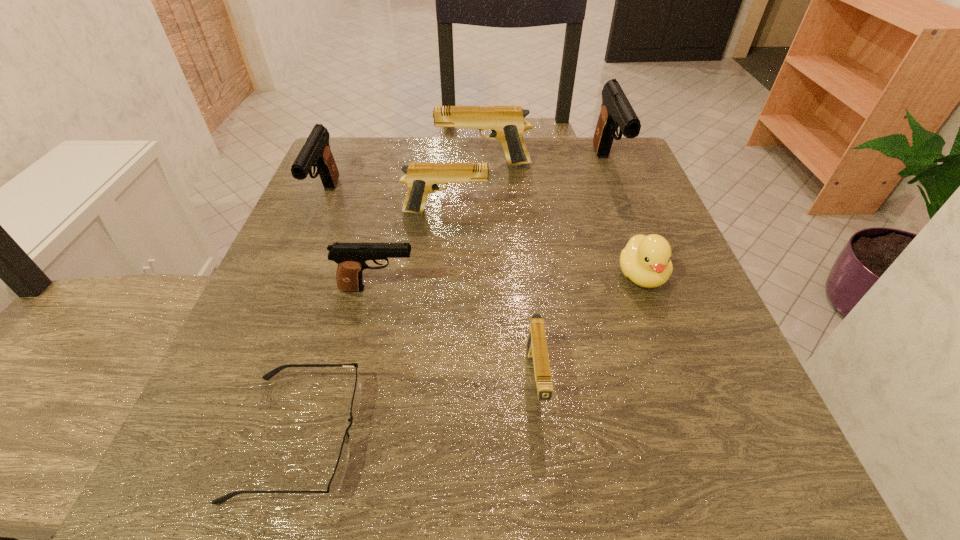
Select which pistol appears as the third closest to the farthest tan pistol. Please provide its 2D coordinates. Your answer should be formatted as a tuple, i.e. [(x, y)], where the tuple contains the x and y coordinates of a point satisfying the conditions above.

[(316, 152)]

Choose which black pistol is the nearest neighbor to the second nearest tan pistol. Please provide its 2D coordinates. Your answer should be formatted as a tuple, i.e. [(x, y)], where the tuple contains the x and y coordinates of a point satisfying the conditions above.

[(316, 152)]

Where is `black pistol that is the third nearest to the shortest object`? This screenshot has height=540, width=960. black pistol that is the third nearest to the shortest object is located at coordinates (616, 112).

Identify which tan pistol is the nearest to the second farthest tan pistol. Please provide its 2D coordinates. Your answer should be formatted as a tuple, i.e. [(x, y)], where the tuple contains the x and y coordinates of a point satisfying the conditions above.

[(507, 123)]

The image size is (960, 540). I want to click on tan pistol that stands as the third closest to the yellow duckling, so click(507, 123).

The height and width of the screenshot is (540, 960). In order to click on free spot that satisfies the following two spatial constraints: 1. on the beak of the yellow duckling; 2. on the front-facing side of the spectacles in this screenshot , I will do `click(701, 436)`.

Identify the location of free space that satisfies the following two spatial constraints: 1. on the beak of the yellow duckling; 2. on the front-facing side of the black spectacles. The image size is (960, 540). (701, 436).